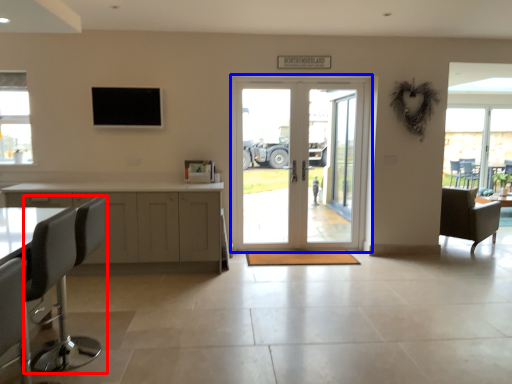
Question: Which point is further to the camera, chair (highlighted by a red box) or door (highlighted by a blue box)?

Choices:
 (A) chair
 (B) door

Answer: (B)